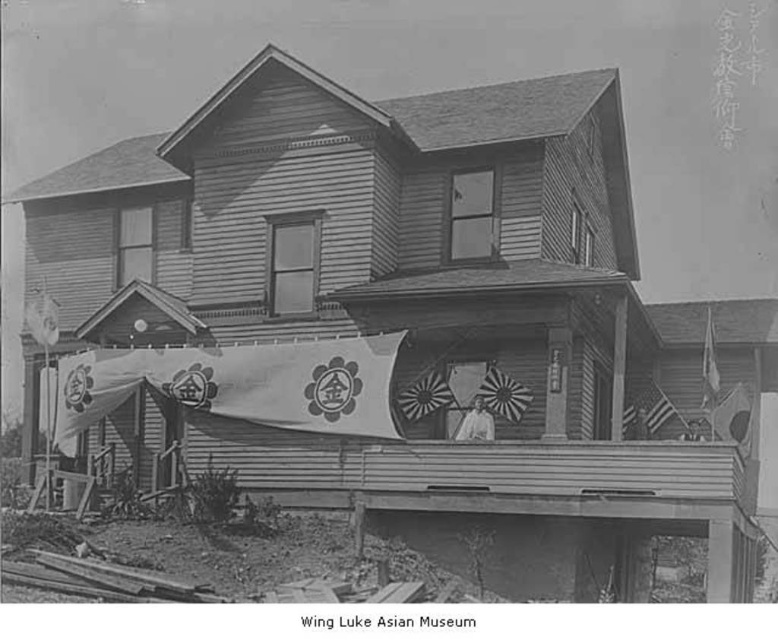
Question: Which object appears closest to the camera in this image?

Choices:
 (A) rusty metal flag at center
 (B) white fabric banner at left

Answer: (A)

Question: Among these points, which one is farthest from the camera?

Choices:
 (A) (654, 385)
 (B) (505, 417)

Answer: (A)

Question: Can you confirm if rusty metal flag at center is positioned to the left of white fabric banner at left?

Choices:
 (A) yes
 (B) no

Answer: (B)

Question: Which point is farther from the camera taking this photo?

Choices:
 (A) (489, 381)
 (B) (72, 356)

Answer: (B)

Question: Does silky fabric flag at right appear under american flag at upper right?

Choices:
 (A) yes
 (B) no

Answer: (B)

Question: In this image, where is rusty metal flag at center located relative to white fabric flag at center?

Choices:
 (A) below
 (B) above

Answer: (B)